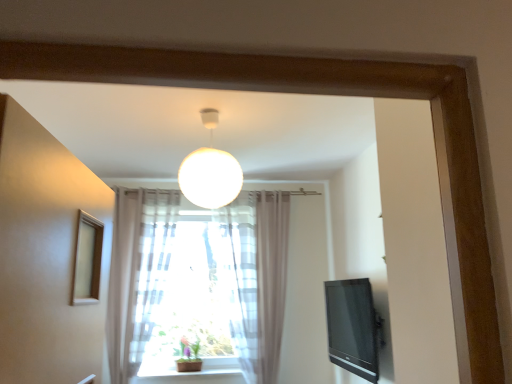
Find the location of `free space above green matte plant at center (from a real-world perspective)`. free space above green matte plant at center (from a real-world perspective) is located at coordinates (190, 334).